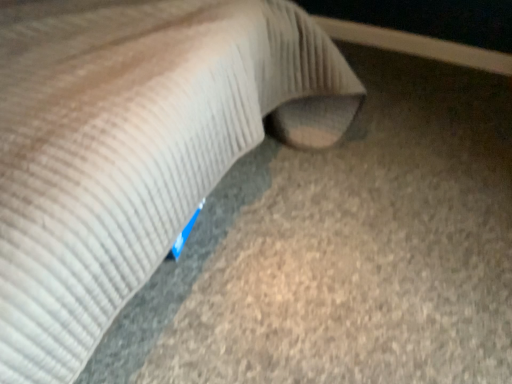
You are a GUI agent. You are given a task and a screenshot of the screen. Output one action in this format:
    pyautogui.click(x=<x>, y=<y>)
    Task: Click on the beige corduroy pillow at center
    The width and height of the screenshot is (512, 384).
    Given the screenshot: What is the action you would take?
    pyautogui.click(x=126, y=148)

Based on the photo, what is the approximate height of beige corduroy pillow at center?

The height of beige corduroy pillow at center is 33.34 inches.

This screenshot has width=512, height=384. Describe the element at coordinates (126, 148) in the screenshot. I see `beige corduroy pillow at center` at that location.

Find the location of a particular element. Image resolution: width=512 pixels, height=384 pixels. beige corduroy pillow at center is located at coordinates [126, 148].